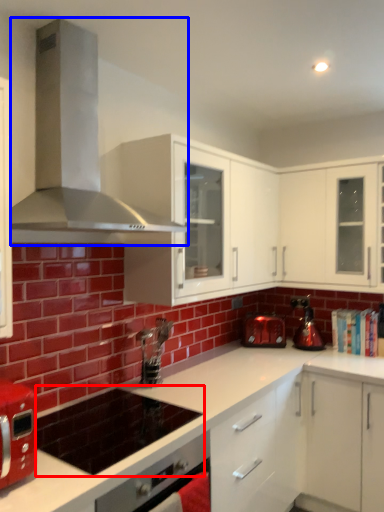
Question: Which point is further to the camera, appliance (highlighted by a red box) or home appliance (highlighted by a blue box)?

Choices:
 (A) appliance
 (B) home appliance

Answer: (A)